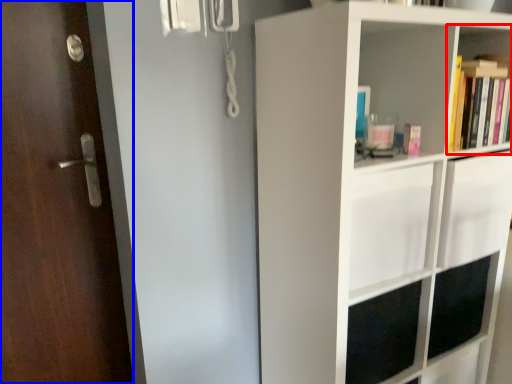
Question: Among these objects, which one is nearest to the camera, shelf (highlighted by a red box) or door (highlighted by a blue box)?

Choices:
 (A) shelf
 (B) door

Answer: (B)